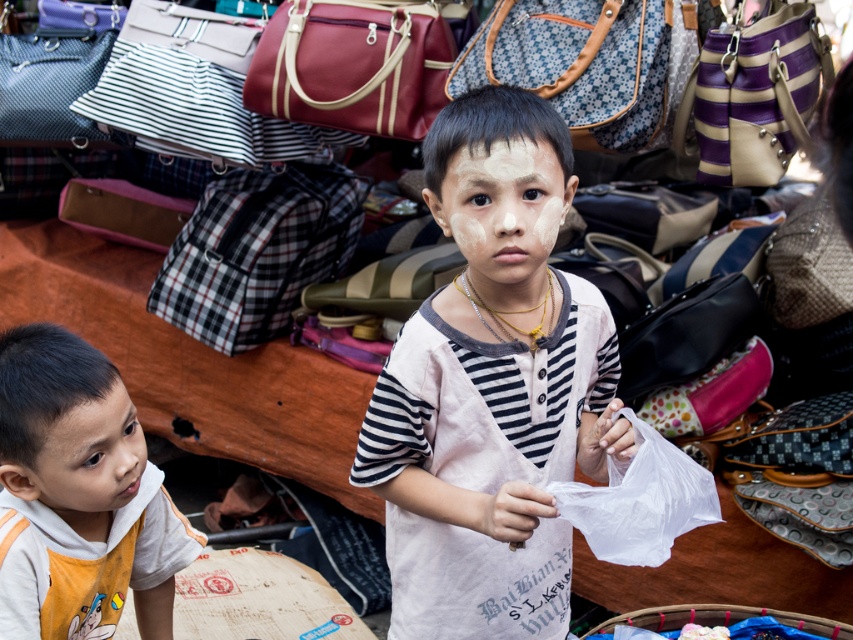
You are a photographer trying to capture both the purple striped leather handbag at upper right and the smooth skin face at lower left in a single frame. Given that the handbag is larger than the face, how should you position your camera to ensure both are clearly visible?

Since the purple striped leather handbag at upper right is larger than the smooth skin face at lower left, you should position your camera closer to the smooth skin face at lower left to balance their sizes in the frame.

Consider the image. You are a parent trying to keep your children safe at the market. The two boys are standing near the plaid fabric bag at center. How far apart are the boys from each other?

The two boys are 10.02 feet apart from each other.